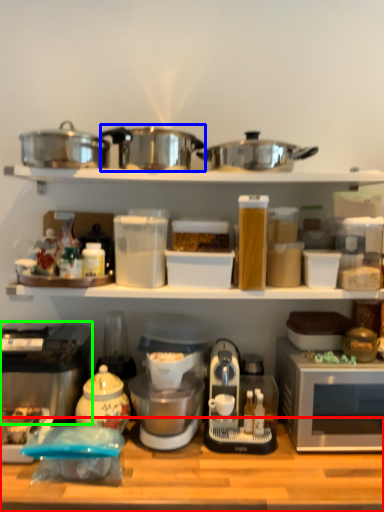
Question: Which is farther away from table (highlighted by a red box)? crock pot (highlighted by a blue box) or home appliance (highlighted by a green box)?

Choices:
 (A) crock pot
 (B) home appliance

Answer: (A)